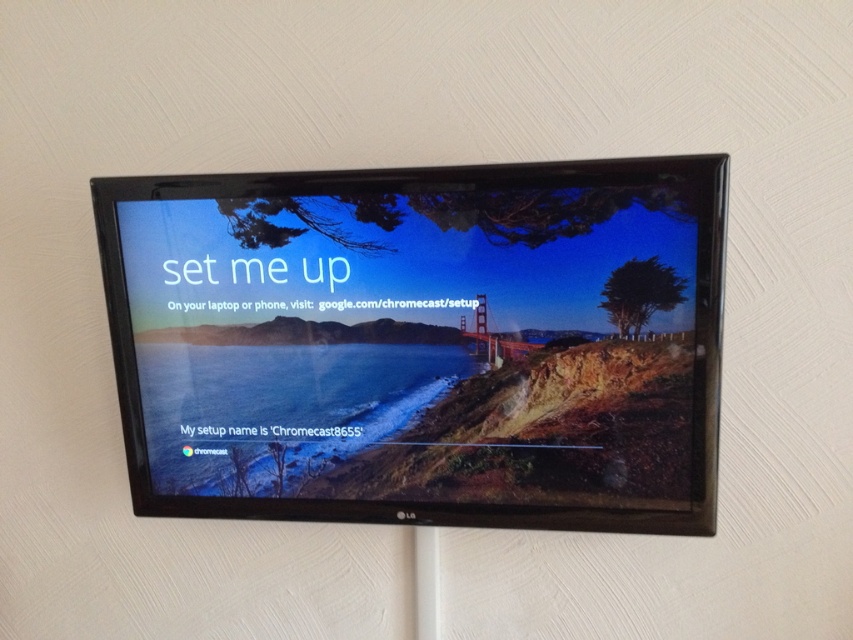
Does point (431, 291) come behind point (543, 344)?

Yes, point (431, 291) is farther from viewer.

Does matte black tv at center have a smaller size compared to metallic bridge at center?

Actually, matte black tv at center might be larger than metallic bridge at center.

Does point (334, 477) lie behind point (517, 356)?

Yes, it is.

You are a GUI agent. You are given a task and a screenshot of the screen. Output one action in this format:
    pyautogui.click(x=<x>, y=<y>)
    Task: Click on the matte black tv at center
    The width and height of the screenshot is (853, 640).
    Given the screenshot: What is the action you would take?
    pyautogui.click(x=421, y=342)